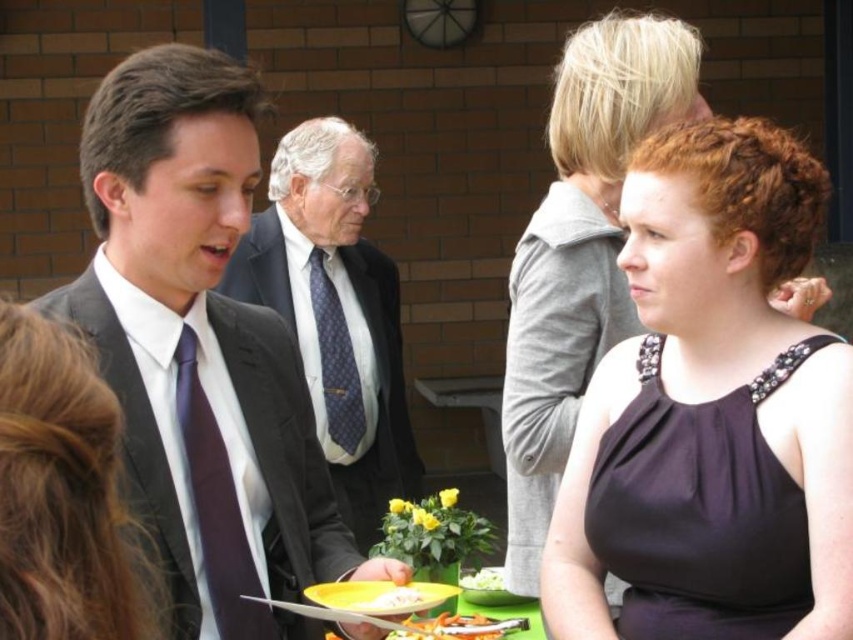
Question: Which is nearer to the white glossy plate at center?

Choices:
 (A) brown hair at center
 (B) black satin dress at center
 (C) purple silk tie at center

Answer: (C)

Question: Which object is positioned farthest from the matte black suit at center?

Choices:
 (A) matte black suit at left
 (B) blue dotted tie at center
 (C) yellow plastic plate at lower center
 (D) smooth orange carrot at lower center

Answer: (A)

Question: Does matte black suit at center have a greater width compared to white creamy salad at center?

Choices:
 (A) yes
 (B) no

Answer: (A)

Question: Among these points, which one is nearest to the camera?

Choices:
 (A) (122, 401)
 (B) (480, 589)

Answer: (A)

Question: Can you confirm if matte black suit at center is positioned to the right of white creamy salad at center?

Choices:
 (A) no
 (B) yes

Answer: (A)

Question: Does yellow matte platter at center have a lesser width compared to white glossy plate at center?

Choices:
 (A) yes
 (B) no

Answer: (B)